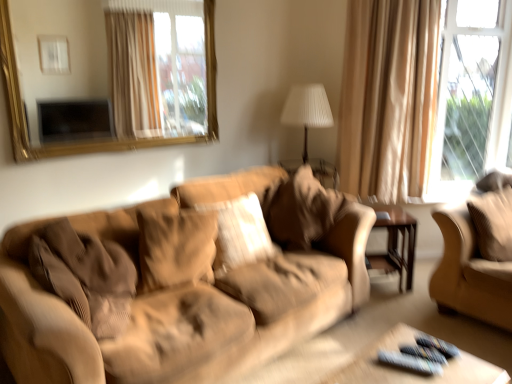
Find the location of `vacant area on top of wooden remote control tray at lower right (from a real-world perspective)`. vacant area on top of wooden remote control tray at lower right (from a real-world perspective) is located at coordinates (416, 369).